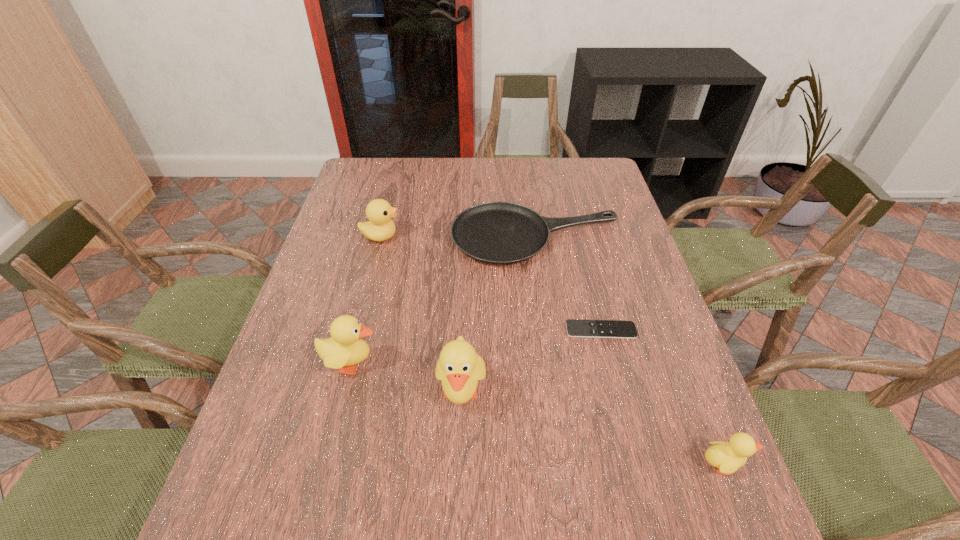
Locate which duckling ranks second in proximity to the shortest object. Please provide its 2D coordinates. Your answer should be formatted as a tuple, i.e. [(x, y)], where the tuple contains the x and y coordinates of a point satisfying the conditions above.

[(727, 457)]

Identify the location of free spot that satisfies the following two spatial constraints: 1. on the face of the fifth tallest object; 2. on the right side of the duck. This screenshot has width=960, height=540. (380, 237).

This screenshot has width=960, height=540. I want to click on free location that satisfies the following two spatial constraints: 1. on the front side of the second shortest object; 2. on the front-facing side of the fifth shortest object, so click(x=555, y=363).

At what (x,y) coordinates should I click in order to perform the action: click on free space that satisfies the following two spatial constraints: 1. on the front side of the shortest object; 2. on the right side of the frying pan. Please return your answer as a coordinate pair (x, y). The height and width of the screenshot is (540, 960). Looking at the image, I should click on (550, 330).